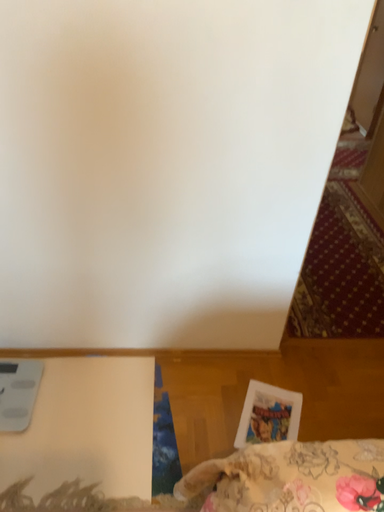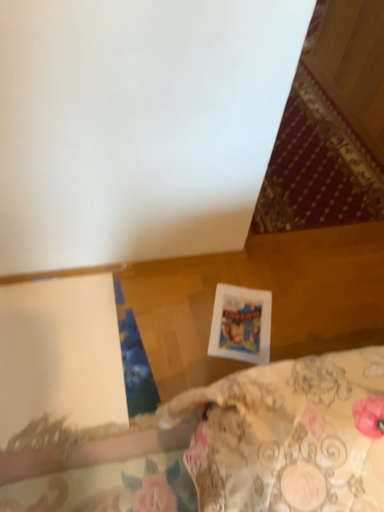
Question: How did the camera likely rotate when shooting the video?

Choices:
 (A) rotated left
 (B) rotated right

Answer: (B)